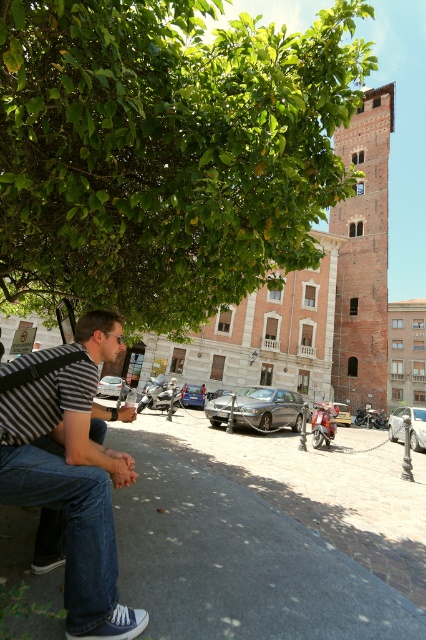
Question: Considering the real-world distances, which object is closest to the brick tower at center?

Choices:
 (A) green leafy tree at upper left
 (B) striped fabric shirt at left

Answer: (A)

Question: Where is green leafy tree at upper left located in relation to brick tower at center in the image?

Choices:
 (A) above
 (B) below

Answer: (A)

Question: Considering the relative positions of striped fabric shirt at left and brick tower at center in the image provided, where is striped fabric shirt at left located with respect to brick tower at center?

Choices:
 (A) left
 (B) right

Answer: (A)

Question: Is green leafy tree at upper left to the right of brick tower at center from the viewer's perspective?

Choices:
 (A) yes
 (B) no

Answer: (B)

Question: Which point is farther to the camera?

Choices:
 (A) green leafy tree at upper left
 (B) striped fabric shirt at left
 (C) brick tower at center

Answer: (C)

Question: Among these objects, which one is nearest to the camera?

Choices:
 (A) brick tower at center
 (B) striped fabric shirt at left

Answer: (B)